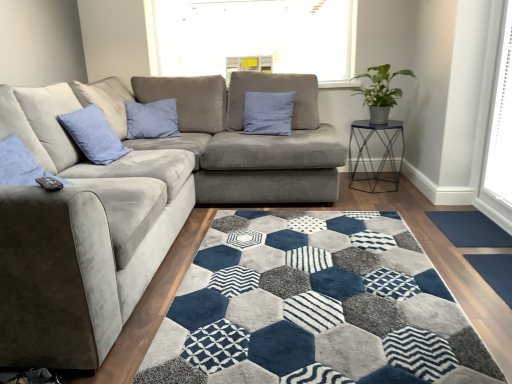
This screenshot has height=384, width=512. Identify the location of dark gray rubber doormat at lower right, the 1th doormat viewed from the front. (495, 272).

This screenshot has width=512, height=384. Describe the element at coordinates (370, 155) in the screenshot. I see `metallic hexagonal table at right` at that location.

The width and height of the screenshot is (512, 384). Find the location of `blue velvet pillow at center, the 2th pillow in the left-to-right sequence`. blue velvet pillow at center, the 2th pillow in the left-to-right sequence is located at coordinates (268, 113).

Could green matte plant at upper right be considered to be inside dark blue textured mat at lower right, the 1th doormat from the back?

That's incorrect, green matte plant at upper right is not inside dark blue textured mat at lower right, the 1th doormat from the back.

Is dark blue textured mat at lower right, which is counted as the second doormat, starting from the front, taller than green matte plant at upper right?

No, dark blue textured mat at lower right, which is counted as the second doormat, starting from the front, is not taller than green matte plant at upper right.

Based on the photo, from the image's perspective, is dark blue textured mat at lower right, the 1th doormat from the back, positioned above or below green matte plant at upper right?

dark blue textured mat at lower right, the 1th doormat from the back, is situated lower than green matte plant at upper right in the image.

Consider the image. Who is bigger, dark gray rubber doormat at lower right, positioned as the second doormat in top-to-bottom order, or green matte plant at upper right?

green matte plant at upper right is bigger.

Does dark gray rubber doormat at lower right, positioned as the second doormat in top-to-bottom order, have a greater width compared to green matte plant at upper right?

No, dark gray rubber doormat at lower right, positioned as the second doormat in top-to-bottom order, is not wider than green matte plant at upper right.

At what (x,y) coordinates should I click in order to perform the action: click on the 1st doormat to the right when counting from the green matte plant at upper right. Please return your answer as a coordinate pair (x, y). This screenshot has width=512, height=384. Looking at the image, I should click on (495, 272).

From the image's perspective, which is below, dark gray rubber doormat at lower right, positioned as the second doormat in top-to-bottom order, or green matte plant at upper right?

dark gray rubber doormat at lower right, positioned as the second doormat in top-to-bottom order, appears lower in the image.

From a real-world perspective, between green matte plant at upper right and metallic hexagonal table at right, who is vertically higher?

green matte plant at upper right is physically above.

Is green matte plant at upper right positioned far away from metallic hexagonal table at right?

Answer: No.

How distant is green matte plant at upper right from metallic hexagonal table at right?

11.35 inches.

Which is in front, green matte plant at upper right or metallic hexagonal table at right?

green matte plant at upper right is more forward.

Find the location of a particular element. pillow behind the blue velvet pillow at upper left, positioned as the first pillow in left-to-right order is located at coordinates (268, 113).

Is blue velvet pillow at center, positioned as the first pillow in right-to-left order, far away from blue velvet pillow at upper left, the 1th pillow when ordered from front to back?

Yes.

From the image's perspective, is blue velvet pillow at center, placed as the 2th pillow when sorted from front to back, beneath blue velvet pillow at upper left, the 2th pillow from the back?

No, from the image's perspective, blue velvet pillow at center, placed as the 2th pillow when sorted from front to back, is not below blue velvet pillow at upper left, the 2th pillow from the back.

Between point (271, 112) and point (88, 137), which one is positioned in front?

Positioned in front is point (88, 137).

Are white plastic blinds at right and suede gray futon at center far apart?

white plastic blinds at right is positioned a significant distance from suede gray futon at center.

Is white plastic blinds at right positioned with its back to suede gray futon at center?

That's not correct — white plastic blinds at right is not looking away from suede gray futon at center.

Which of these two, white plastic blinds at right or suede gray futon at center, is bigger?

suede gray futon at center is bigger.

Is suede gray futon at center located within white plastic blinds at right?

No, suede gray futon at center is not inside white plastic blinds at right.

Locate an element on the screen. The width and height of the screenshot is (512, 384). window screen that is on the right side of blue velvet pillow at center, placed as the 2th pillow when sorted from front to back is located at coordinates (500, 127).

Which of these two, white plastic blinds at right or blue velvet pillow at center, the 2th pillow in the left-to-right sequence, is thinner?

Thinner between the two is white plastic blinds at right.

Is point (258, 118) positioned before point (499, 256)?

No, (258, 118) is behind (499, 256).

Considering the positions of objects blue velvet pillow at center, acting as the first pillow starting from the back, and dark gray rubber doormat at lower right, which is counted as the 1th doormat, starting from the bottom, in the image provided, who is more to the right, blue velvet pillow at center, acting as the first pillow starting from the back, or dark gray rubber doormat at lower right, which is counted as the 1th doormat, starting from the bottom,?

From the viewer's perspective, dark gray rubber doormat at lower right, which is counted as the 1th doormat, starting from the bottom, appears more on the right side.

Which object is more forward, blue velvet pillow at center, positioned as the first pillow in right-to-left order, or dark gray rubber doormat at lower right, positioned as the second doormat in top-to-bottom order?

dark gray rubber doormat at lower right, positioned as the second doormat in top-to-bottom order, is in front.

From a real-world perspective, which object stands above the other?

In real-world perspective, blue velvet pillow at center, positioned as the first pillow in right-to-left order, is above.

From the image's perspective, starting from the green matte plant at upper right, which doormat is the 1st one below? Please provide its 2D coordinates.

[(470, 229)]

This screenshot has height=384, width=512. I want to click on houseplant above the dark gray rubber doormat at lower right, positioned as the second doormat in top-to-bottom order (from the image's perspective), so click(380, 92).

Looking at the image, which one is located closer to blue velvet pillow at center, the 2th pillow in the left-to-right sequence, dark gray rubber doormat at lower right, which is counted as the 1th doormat, starting from the bottom, or white plastic blinds at right?

white plastic blinds at right lies closer to blue velvet pillow at center, the 2th pillow in the left-to-right sequence, than the other object.

Considering their positions, is dark blue textured mat at lower right, acting as the 2th doormat starting from the bottom, positioned further to dark gray rubber doormat at lower right, which is counted as the 1th doormat, starting from the bottom, than green matte plant at upper right?

Based on the image, green matte plant at upper right appears to be further to dark gray rubber doormat at lower right, which is counted as the 1th doormat, starting from the bottom.

From the image, which object appears to be farther from suede gray futon at center, white plastic blinds at right or blue velvet pillow at upper left, positioned as the first pillow in left-to-right order?

The object further to suede gray futon at center is white plastic blinds at right.

Consider the image. Estimate the real-world distances between objects in this image. Which object is closer to green matte plant at upper right, white plastic blinds at right or dark blue textured mat at lower right, the 1th doormat from the back?

white plastic blinds at right is positioned closer to the anchor green matte plant at upper right.

Which object lies nearer to the anchor point blue velvet pillow at center, placed as the 2th pillow when sorted from front to back, white plastic blinds at right or dark blue textured mat at lower right, which is counted as the second doormat, starting from the front?

dark blue textured mat at lower right, which is counted as the second doormat, starting from the front, lies closer to blue velvet pillow at center, placed as the 2th pillow when sorted from front to back, than the other object.

Looking at the image, which one is located closer to white plastic blinds at right, dark gray rubber doormat at lower right, the 1th doormat viewed from the front, or blue velvet pillow at center, the 2th pillow in the left-to-right sequence?

The object closer to white plastic blinds at right is dark gray rubber doormat at lower right, the 1th doormat viewed from the front.

Looking at this image, estimate the real-world distances between objects in this image. Which object is closer to white plastic blinds at right, suede gray futon at center or metallic hexagonal table at right?

metallic hexagonal table at right lies closer to white plastic blinds at right than the other object.

When comparing their distances from dark gray rubber doormat at lower right, the 2th doormat positioned from the back, does blue velvet pillow at upper left, the 2th pillow when ordered from right to left, or metallic hexagonal table at right seem further?

blue velvet pillow at upper left, the 2th pillow when ordered from right to left, lies further to dark gray rubber doormat at lower right, the 2th doormat positioned from the back, than the other object.

The width and height of the screenshot is (512, 384). In order to click on doormat between velvet gray couch at center and dark blue textured mat at lower right, acting as the 2th doormat starting from the bottom in this screenshot , I will do `click(495, 272)`.

At what (x,y) coordinates should I click in order to perform the action: click on houseplant situated between blue velvet pillow at upper left, the 2th pillow from the back, and dark blue textured mat at lower right, which is counted as the second doormat, starting from the front, from left to right. Please return your answer as a coordinate pair (x, y). This screenshot has height=384, width=512. Looking at the image, I should click on (380, 92).

Locate an element on the screen. doormat between white plastic blinds at right and dark gray rubber doormat at lower right, the 1th doormat viewed from the front, from top to bottom is located at coordinates (470, 229).

Where is `futon between blue velvet pillow at upper left, the 2th pillow from the back, and white plastic blinds at right`? futon between blue velvet pillow at upper left, the 2th pillow from the back, and white plastic blinds at right is located at coordinates pyautogui.click(x=193, y=135).